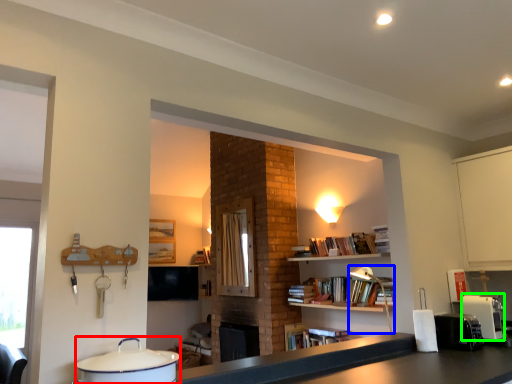
Question: Which object is positioned farthest from appliance (highlighted by a red box)? Select from lamp (highlighted by a blue box) and coffee machine (highlighted by a green box).

Choices:
 (A) lamp
 (B) coffee machine

Answer: (A)